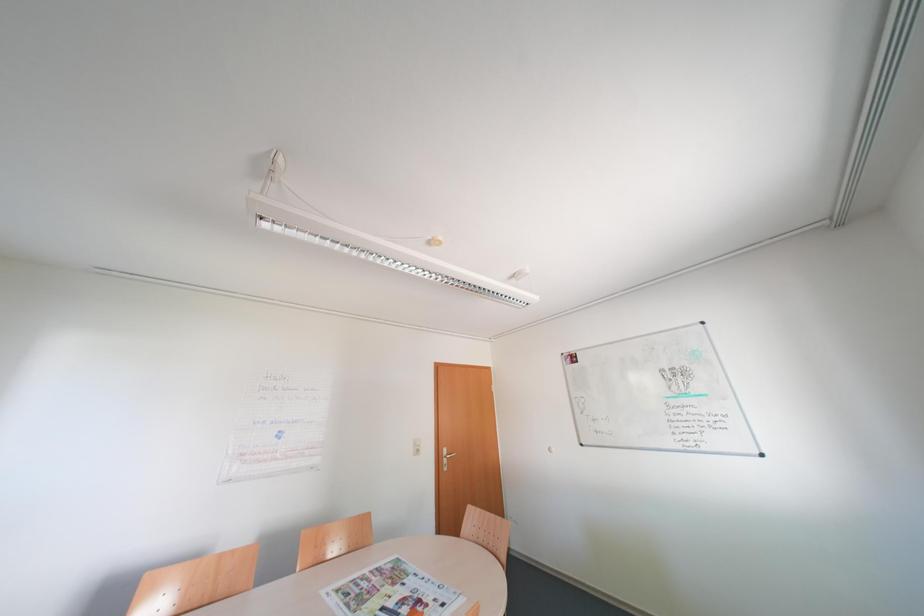
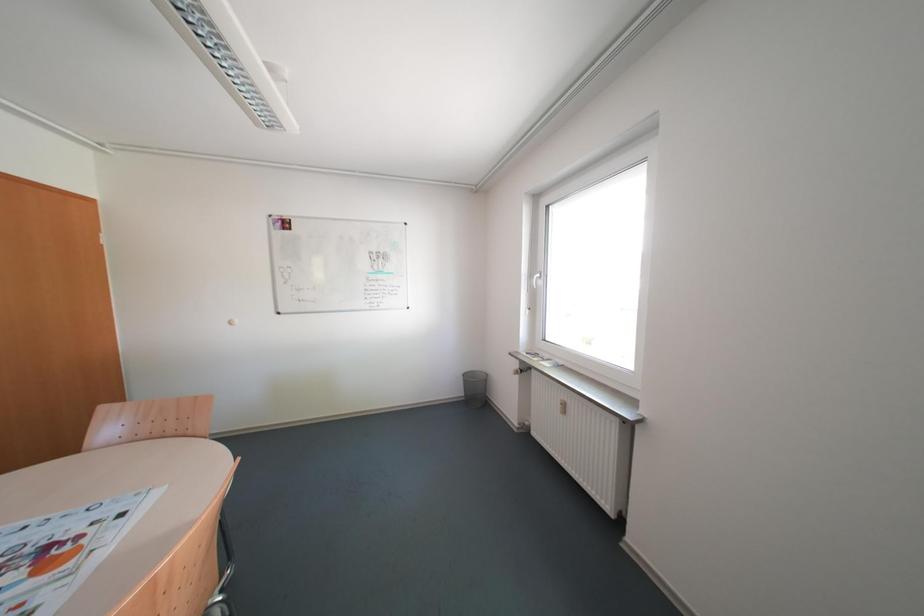
Question: The images are taken continuously from a first-person perspective. In which direction is your viewpoint rotating?

Choices:
 (A) Left
 (B) Right
 (C) Up
 (D) Down

Answer: (B)